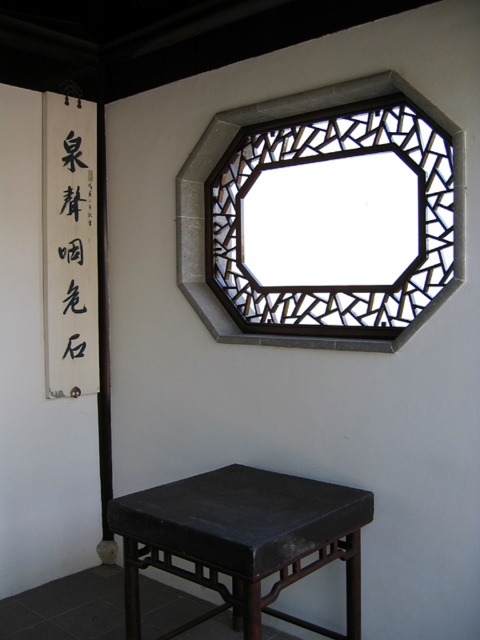
Does matte black table at lower center lie in front of black lattice window at upper center?

Yes.

Which is more to the right, matte black table at lower center or black lattice window at upper center?

black lattice window at upper center

Which is behind, point (252, 490) or point (264, 333)?

The point (264, 333) is more distant.

Locate an element on the screen. matte black table at lower center is located at coordinates (242, 540).

Does black lattice window at upper center lie in front of black paper calligraphy at left?

Yes.

Who is higher up, black lattice window at upper center or black paper calligraphy at left?

black paper calligraphy at left is above.

Which is behind, point (433, 108) or point (78, 205)?

The point (78, 205) is more distant.

You are a GUI agent. You are given a task and a screenshot of the screen. Output one action in this format:
    pyautogui.click(x=<x>, y=<y>)
    Task: Click on the black lattice window at upper center
    This screenshot has width=480, height=640.
    Given the screenshot: What is the action you would take?
    pyautogui.click(x=219, y=157)

Is point (88, 268) closer to viewer compared to point (62, 257)?

No.

Who is taller, white paper sign at left or black paper calligraphy at left?

white paper sign at left is taller.

Between point (52, 371) and point (71, 209), which one is positioned in front?

Positioned in front is point (52, 371).

Locate an element on the screen. The image size is (480, 640). white paper sign at left is located at coordinates (70, 246).